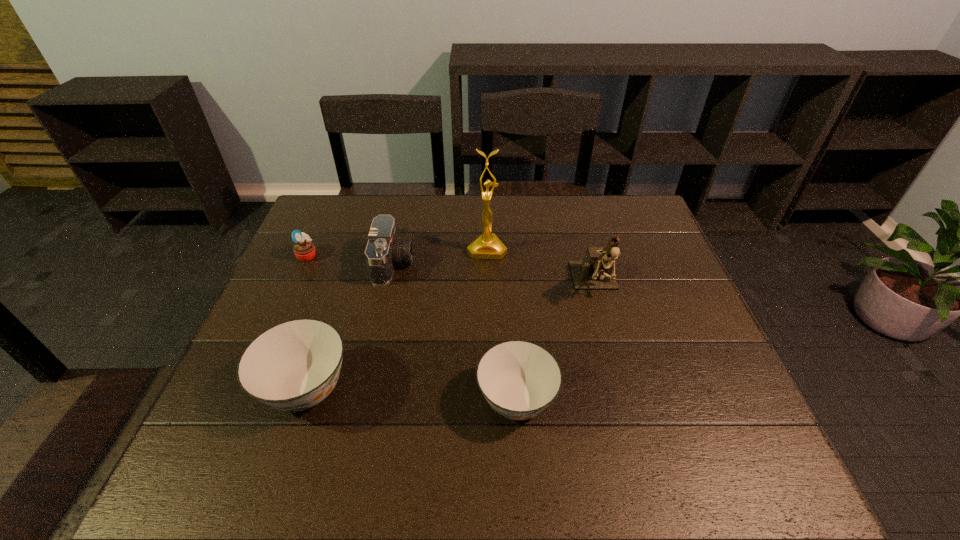
Identify the location of free point that keeps the soup bowls evenly spaced on the right. Image resolution: width=960 pixels, height=540 pixels. (736, 411).